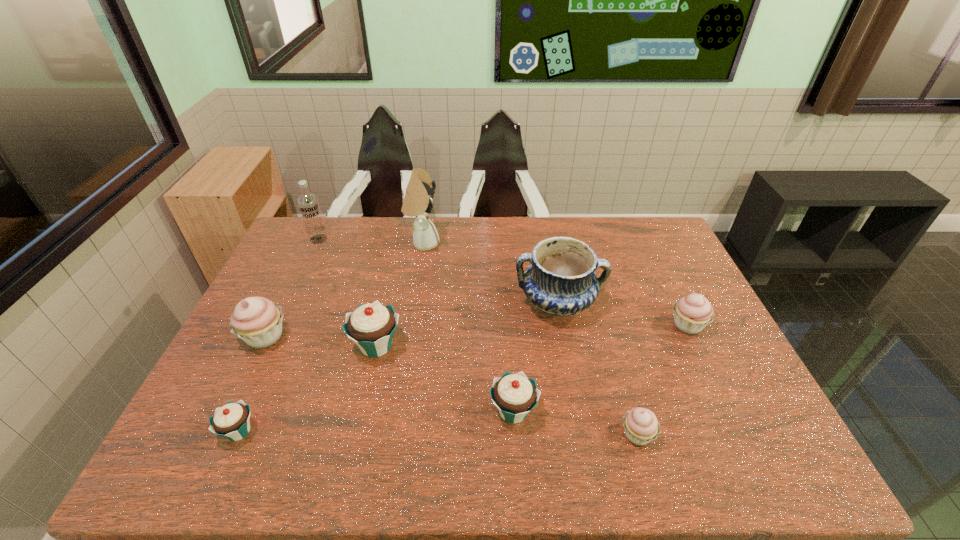
Where is `free spot at the far edge of the desktop`? free spot at the far edge of the desktop is located at coordinates (367, 250).

You are a GUI agent. You are given a task and a screenshot of the screen. Output one action in this format:
    pyautogui.click(x=<x>, y=<y>)
    Task: Click on the vacant point at the near edge
    
    Given the screenshot: What is the action you would take?
    pyautogui.click(x=471, y=468)

This screenshot has height=540, width=960. Find the location of `vacant space at the left edge of the desktop`. vacant space at the left edge of the desktop is located at coordinates (308, 272).

The height and width of the screenshot is (540, 960). I want to click on vacant area at the right edge, so click(661, 294).

This screenshot has height=540, width=960. Find the location of `vacant space at the near left corner`. vacant space at the near left corner is located at coordinates click(206, 447).

In the image, there is a desktop. In order to click on vacant region at the far right corner in this screenshot , I will do `click(636, 250)`.

Where is `empty space that is in between the vodka and the fourth cupcake from left to right`? This screenshot has height=540, width=960. empty space that is in between the vodka and the fourth cupcake from left to right is located at coordinates (416, 325).

Locate an element on the screen. The height and width of the screenshot is (540, 960). blank region between the blue pottery and the eighth shortest object is located at coordinates (438, 271).

Where is `free spot between the leftmost teal cupcake and the biggest teal cupcake`? Image resolution: width=960 pixels, height=540 pixels. free spot between the leftmost teal cupcake and the biggest teal cupcake is located at coordinates (307, 388).

At what (x,y) coordinates should I click in order to perform the action: click on free space between the rightmost cupcake and the seventh shortest object. Please return your answer as a coordinate pair (x, y). This screenshot has width=960, height=540. Looking at the image, I should click on point(622,314).